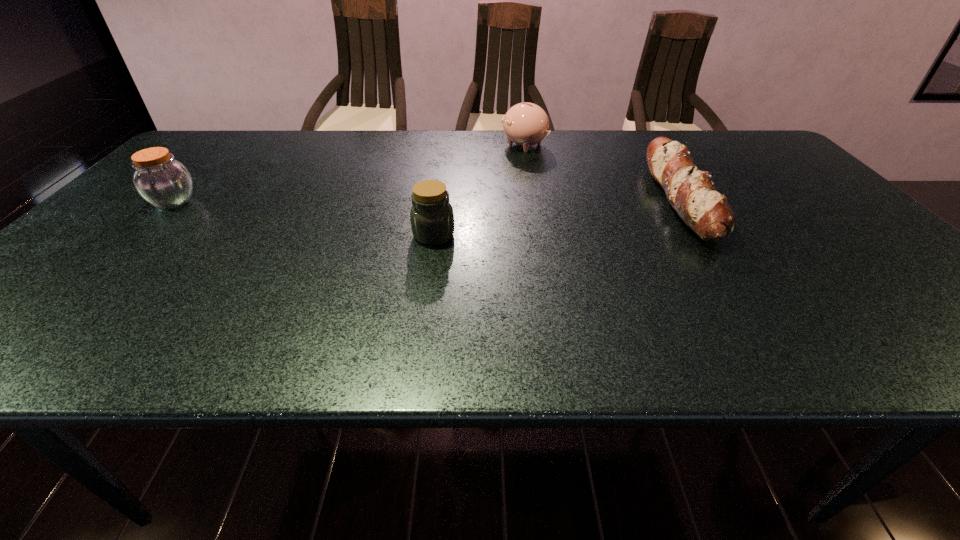
Find the location of a particular element. free space between the second object from left to right and the left jar is located at coordinates (303, 218).

Find the location of a particular element. The width and height of the screenshot is (960, 540). free spot between the right jar and the farther jar is located at coordinates (303, 218).

The width and height of the screenshot is (960, 540). What are the coordinates of `vacant point located between the farthest object and the nearer jar` in the screenshot? It's located at (479, 190).

Identify the location of free spot between the nearer jar and the farthest object. (479, 190).

At what (x,y) coordinates should I click in order to perform the action: click on vacant point located between the right jar and the baguet. Please return your answer as a coordinate pair (x, y). This screenshot has width=960, height=540. Looking at the image, I should click on (557, 217).

Where is `blank region between the farther jar and the farthest object`? The height and width of the screenshot is (540, 960). blank region between the farther jar and the farthest object is located at coordinates (348, 173).

This screenshot has width=960, height=540. What are the coordinates of `vacant region between the leftmost object and the piggy bank` in the screenshot? It's located at (348, 173).

Identify the location of object that is the third closest one to the rightmost object. pyautogui.click(x=165, y=183).

You are a GUI agent. You are given a task and a screenshot of the screen. Output one action in this format:
    pyautogui.click(x=<x>, y=<y>)
    Task: Click on the object that stands as the second closest to the left jar
    
    Given the screenshot: What is the action you would take?
    pyautogui.click(x=526, y=124)